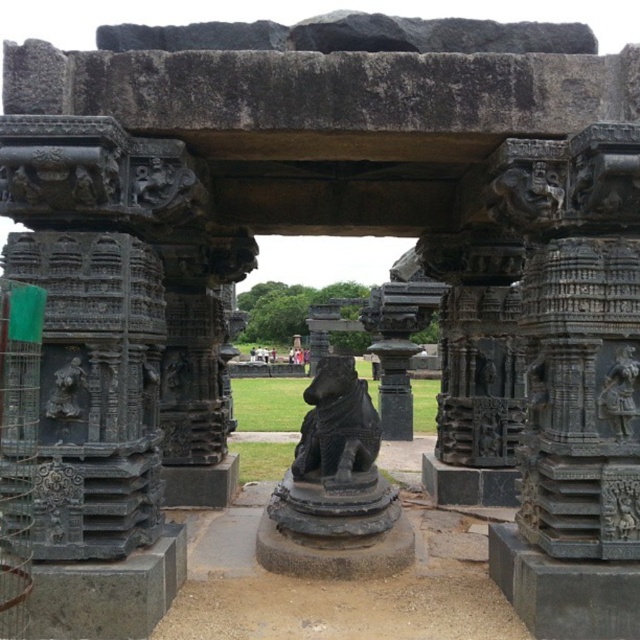
Who is lower down, black stone statue at center or dark gray stone lion at left?

black stone statue at center is below.

Does black stone statue at center have a larger size compared to dark gray stone lion at left?

Indeed, black stone statue at center has a larger size compared to dark gray stone lion at left.

Locate an element on the screen. The width and height of the screenshot is (640, 640). black stone statue at center is located at coordinates (337, 424).

Can you confirm if dark gray stone carving at center is bigger than dark gray stone lion at left?

No.

Between point (624, 496) and point (61, 412), which one is positioned in front?

Point (61, 412)

Who is more forward, (609, 492) or (77, 388)?

Positioned in front is point (77, 388).

Locate an element on the screen. The height and width of the screenshot is (640, 640). dark gray stone carving at center is located at coordinates (620, 502).

Is point (608, 419) farther from viewer compared to point (64, 380)?

Yes.

Between point (627, 422) and point (76, 362), which one is positioned in front?

Point (76, 362) is more forward.

Locate an element on the screen. dark gray stone statue at center is located at coordinates (620, 392).